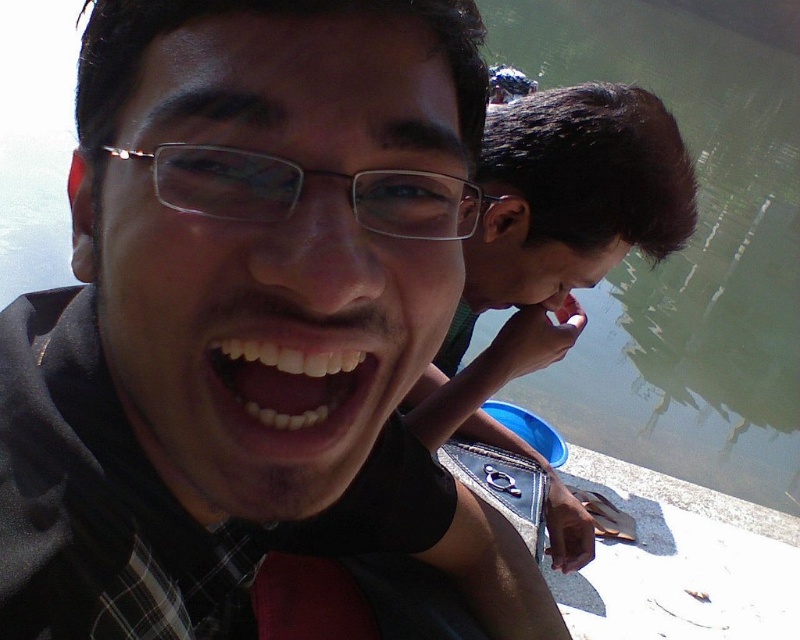
You are trying to place a small toy boat in the scene. The boat requires a space wider than the clear plastic glasses at center. Can the greenish water at upper right accommodate the boat?

The greenish water at upper right has a larger width than the clear plastic glasses at center, so the boat can fit in the greenish water at upper right.

You are holding a 7 inch ruler and want to measure the distance between the matte black jacket at center and the clear plastic glasses at center in the selfie. Can you fit the ruler between them to measure the distance?

The matte black jacket at center is 6.97 inches away from the clear plastic glasses at center. Since the ruler is exactly 7 inches long, it can just barely fit between them to measure the distance.